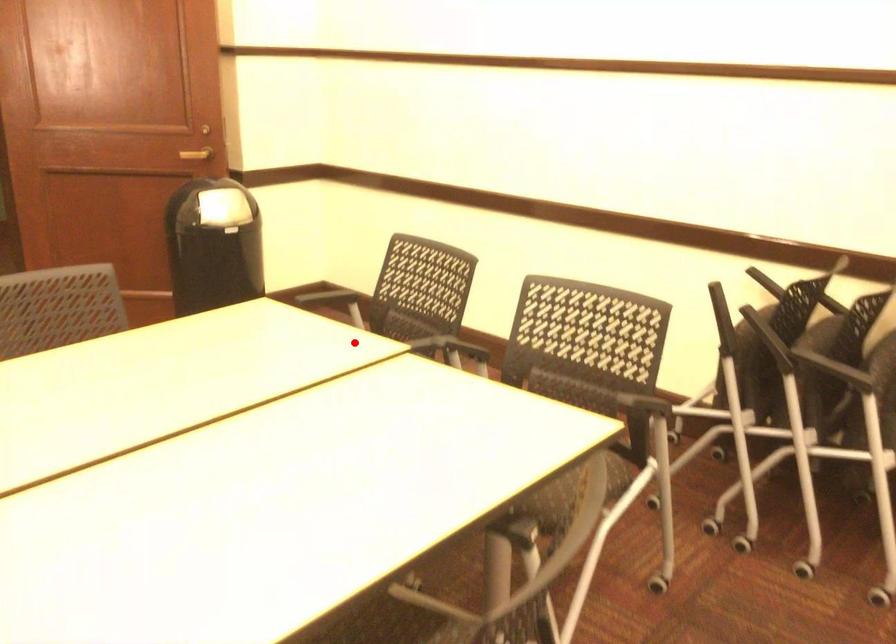
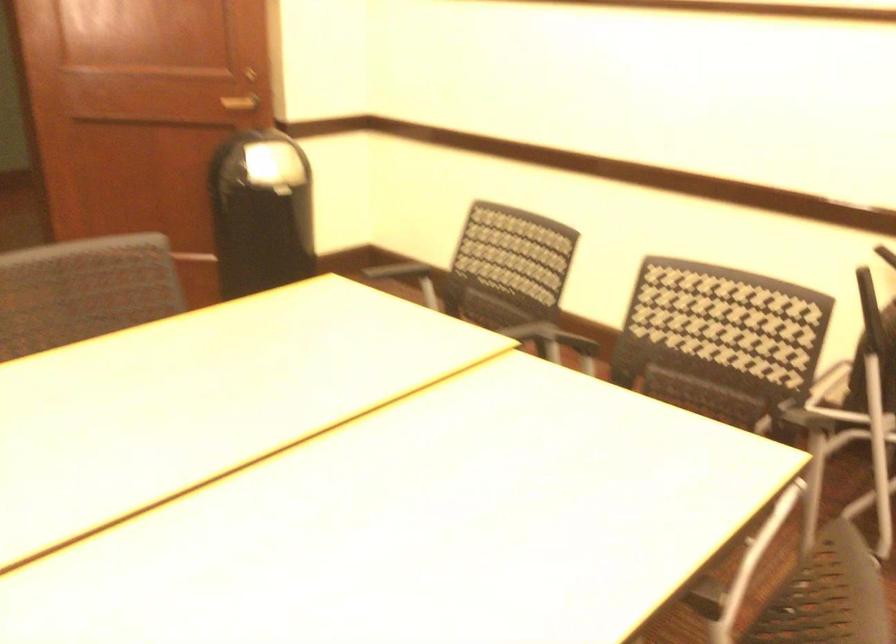
Question: I am providing you with two images of the same scene from different viewpoints. Given a red point in image1, look at the same physical point in image2. Is it:

Choices:
 (A) Closer to the viewpoint
 (B) Farther from the viewpoint

Answer: (A)